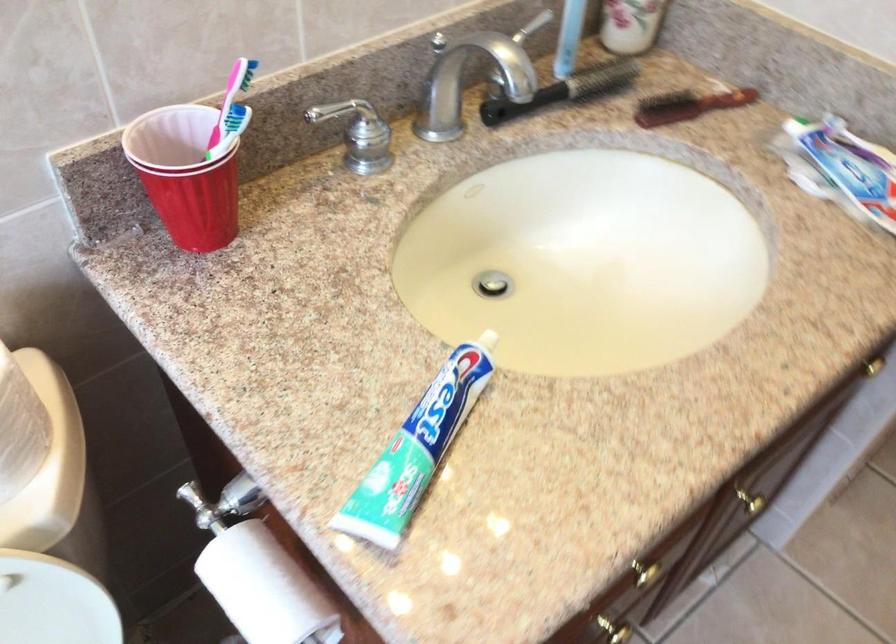
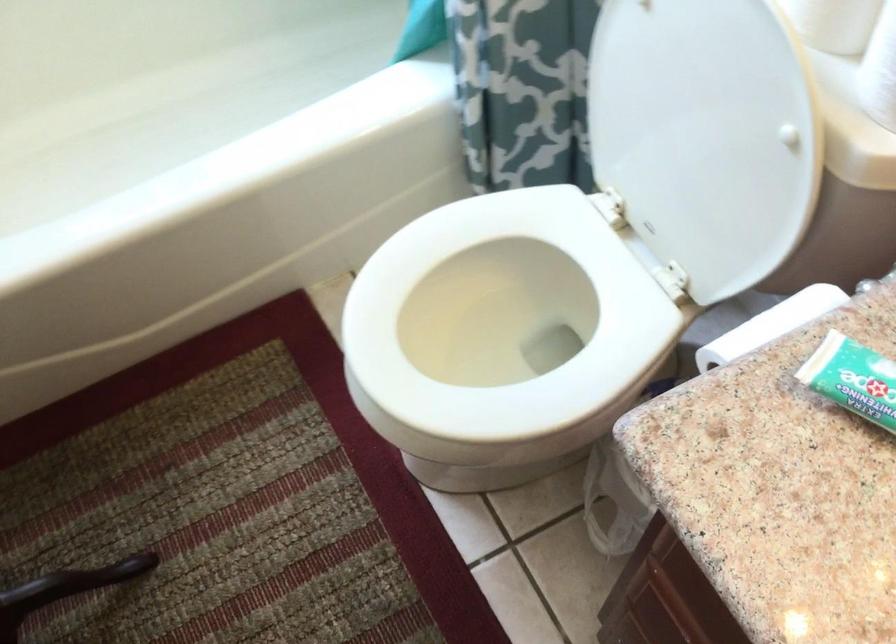
First-person continuous shooting, in which direction is the camera rotating?

The camera's rotation is toward left-down.